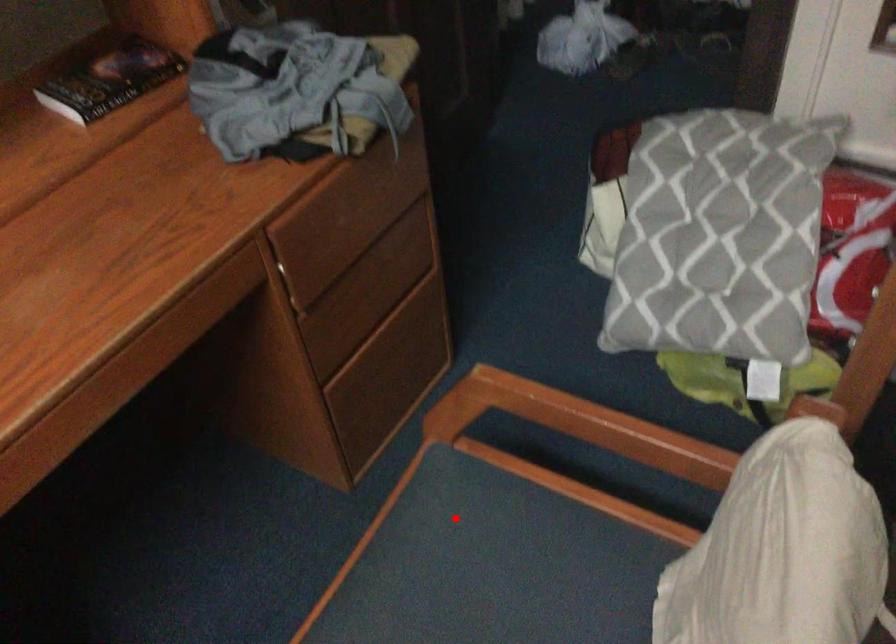
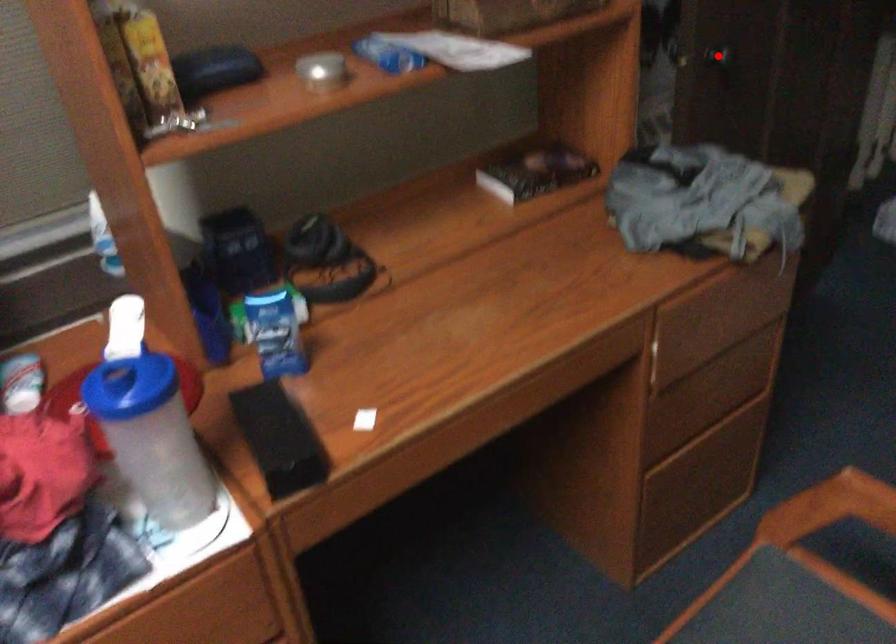
I am providing you with two images of the same scene from different viewpoints. A red point is marked on the first image and another point is marked on the second image. Is the marked point in image1 the same physical position as the marked point in image2?

No